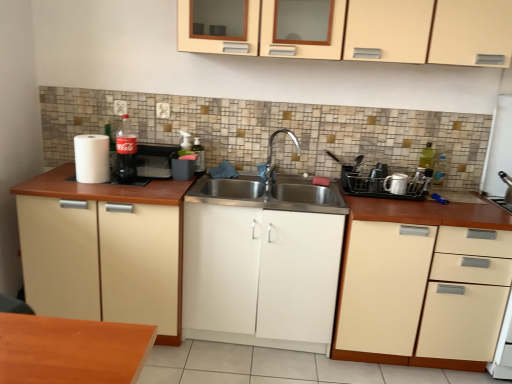
Question: Based on their positions, is black plastic dish rack at right, which is the second appliance in left-to-right order, located to the left or right of beige matte cabinet at right, marked as the 4th cabinetry in a left-to-right arrangement?

Choices:
 (A) right
 (B) left

Answer: (B)

Question: Considering their positions, is black plastic dish rack at right, which is the second appliance in left-to-right order, located in front of or behind beige matte cabinet at right, placed as the first cabinetry when sorted from right to left?

Choices:
 (A) behind
 (B) front

Answer: (A)

Question: Estimate the real-world distances between objects in this image. Which object is farther from the white matte cabinet at center, the third cabinetry positioned from the right?

Choices:
 (A) beige matte cabinet at left, acting as the 4th cabinetry starting from the right
 (B) matte cream cabinet at upper center, acting as the second cabinetry starting from the right
 (C) white glossy mug at right, the first appliance from the right
 (D) white matte paper towel at left
 (E) matte glass coca-cola bottle at left, which is counted as the 2th bottle, starting from the back

Answer: (B)

Question: Which is farther from the translucent plastic soap dispenser at center, which is the second bottle from left to right?

Choices:
 (A) white matte dish rack at center right, which appears as the 3th appliance when viewed from the right
 (B) white matte cabinet at center, the third cabinetry positioned from the right
 (C) beige matte cabinet at right, placed as the first cabinetry when sorted from right to left
 (D) matte glass coca-cola bottle at left, which is counted as the 2th bottle, starting from the back
 (E) black plastic dish rack at right, which is the second appliance in left-to-right order

Answer: (C)